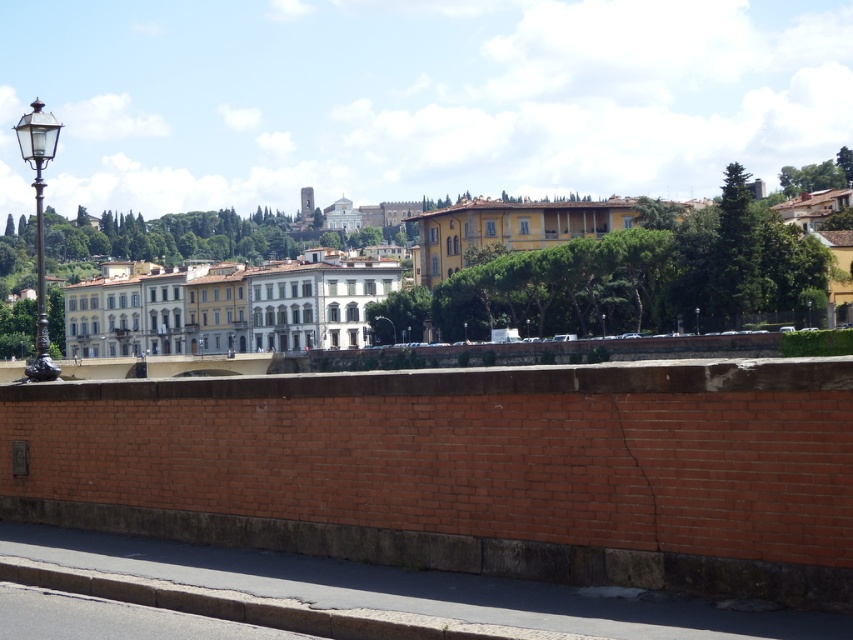
Is point (375, 614) more distant than point (395, 340)?

That is False.

Does point (154, 589) lie in front of point (395, 342)?

Yes, point (154, 589) is in front of point (395, 342).

Find the location of a particular element. gray concrete curb at lower left is located at coordinates (260, 605).

Is white glossy building at center closer to camera compared to gray concrete curb at lower left?

No, white glossy building at center is behind gray concrete curb at lower left.

Describe the element at coordinates (229, 307) in the screenshot. The width and height of the screenshot is (853, 640). I see `white glossy building at center` at that location.

Find the location of a particular element. Image resolution: width=853 pixels, height=640 pixels. white glossy building at center is located at coordinates (229, 307).

Measure the distance between point (125, 291) and camera.

Point (125, 291) and camera are 209.82 meters apart from each other.

Looking at this image, is white glossy building at center taller than metallic streetlight at center?

Yes, white glossy building at center is taller than metallic streetlight at center.

Is point (109, 340) farther from camera compared to point (395, 336)?

Yes, it is behind point (395, 336).

Locate an element on the screen. white glossy building at center is located at coordinates (229, 307).